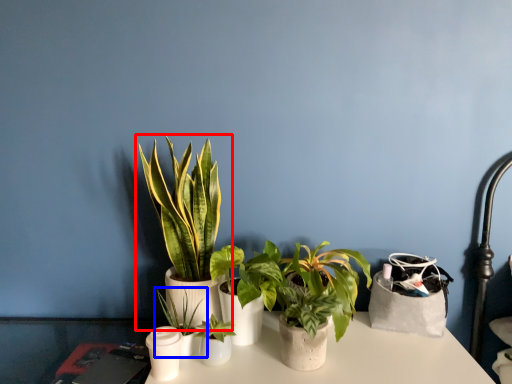
Question: Among these objects, which one is nearest to the camera, houseplant (highlighted by a red box) or houseplant (highlighted by a blue box)?

Choices:
 (A) houseplant
 (B) houseplant

Answer: (A)